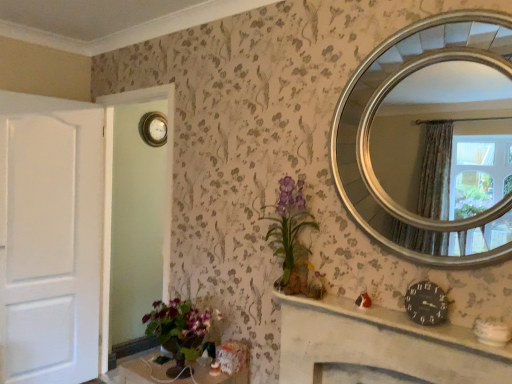
The height and width of the screenshot is (384, 512). Find the location of `free spot below silver/golden mirror at upper right (from a real-world perspective)`. free spot below silver/golden mirror at upper right (from a real-world perspective) is located at coordinates (408, 310).